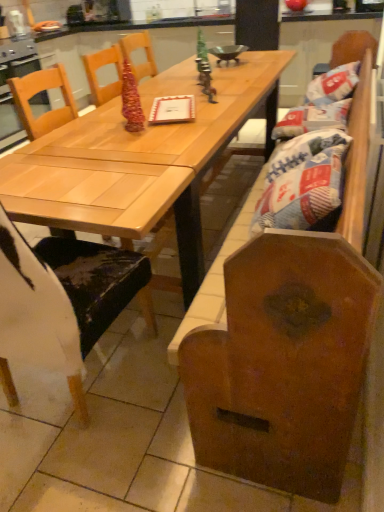
What is the approximate width of wooden chair at left?

The width of wooden chair at left is 25.56 inches.

The image size is (384, 512). I want to click on light wood table at center, so click(141, 161).

The height and width of the screenshot is (512, 384). In order to click on white paper bag at right in this screenshot , I will do `click(302, 182)`.

From the picture: Can you tell me how much wooden chair at left and white paper bag at right differ in facing direction?

There is a 97.1-degree angle between the facing directions of wooden chair at left and white paper bag at right.

The height and width of the screenshot is (512, 384). Identify the location of material to the right of wooden chair at left. (302, 182).

Is wooden chair at left in contact with white paper bag at right?

wooden chair at left and white paper bag at right are not in contact.

From the image's perspective, is wooden chair at left located above or below white paper bag at right?

Clearly, from the image's perspective, wooden chair at left is below white paper bag at right.

Which object is wider, light wood table at center or white paper bag at right?

Wider between the two is light wood table at center.

Between point (16, 200) and point (337, 208), which one is positioned behind?

The point (16, 200) is farther.

Consider the image. How many degrees apart are the facing directions of light wood table at center and white paper bag at right?

The facing directions of light wood table at center and white paper bag at right are 7.04 degrees apart.

Is wooden chair at left to the left or to the right of light wood table at center in the image?

In the image, wooden chair at left appears on the left side of light wood table at center.

Looking at their sizes, would you say wooden chair at left is wider or thinner than light wood table at center?

Clearly, wooden chair at left has less width compared to light wood table at center.

Is wooden chair at left not inside light wood table at center?

No.

Is wooden chair at left facing towards light wood table at center?

Yes, wooden chair at left is oriented towards light wood table at center.

Can you tell me how much light wood table at center and wooden chair at left differ in facing direction?

They differ by 90 degrees in their facing directions.

Is light wood table at center not within wooden chair at left?

Yes, light wood table at center is not within wooden chair at left.

Which of these two, light wood table at center or wooden chair at left, stands taller?

wooden chair at left.

From the image's perspective, would you say light wood table at center is positioned over wooden chair at left?

Yes, from the image's perspective, light wood table at center is on top of wooden chair at left.

From a real-world perspective, between white paper bag at right and wooden chair at left, who is vertically higher?

From a 3D spatial view, white paper bag at right is above.

Considering the sizes of objects white paper bag at right and wooden chair at left in the image provided, who is smaller, white paper bag at right or wooden chair at left?

With smaller size is white paper bag at right.

Is point (260, 218) farther from camera compared to point (34, 330)?

Yes, point (260, 218) is behind point (34, 330).

Is white paper bag at right to the left of wooden chair at left from the viewer's perspective?

No, white paper bag at right is not to the left of wooden chair at left.

In the scene shown: Is white paper bag at right not close to light wood table at center?

No.

How much distance is there between white paper bag at right and light wood table at center?

They are 57.58 centimeters apart.

Which object is closer to the camera taking this photo, white paper bag at right or light wood table at center?

light wood table at center.

Considering the points (314, 198) and (73, 153), which point is in front, point (314, 198) or point (73, 153)?

The point (314, 198) is more forward.

The width and height of the screenshot is (384, 512). I want to click on material above the wooden chair at left (from the image's perspective), so click(x=302, y=182).

Locate an element on the screen. material below the light wood table at center (from the image's perspective) is located at coordinates (302, 182).

Based on the photo, when comparing their distances from white paper bag at right, does light wood table at center or wooden chair at left seem further?

wooden chair at left lies further to white paper bag at right than the other object.

From the image, which object appears to be nearer to wooden chair at left, light wood table at center or white paper bag at right?

Based on the image, light wood table at center appears to be nearer to wooden chair at left.

Looking at the image, which one is located closer to light wood table at center, wooden chair at left or white paper bag at right?

The object closer to light wood table at center is white paper bag at right.

When comparing their distances from white paper bag at right, does wooden chair at left or light wood table at center seem further?

wooden chair at left.

Based on their spatial positions, is white paper bag at right or wooden chair at left further from light wood table at center?

wooden chair at left.

From the image, which object appears to be nearer to wooden chair at left, white paper bag at right or light wood table at center?

light wood table at center is closer to wooden chair at left.

This screenshot has height=512, width=384. What are the coordinates of `table located between wooden chair at left and white paper bag at right in the left-right direction` in the screenshot? It's located at (141, 161).